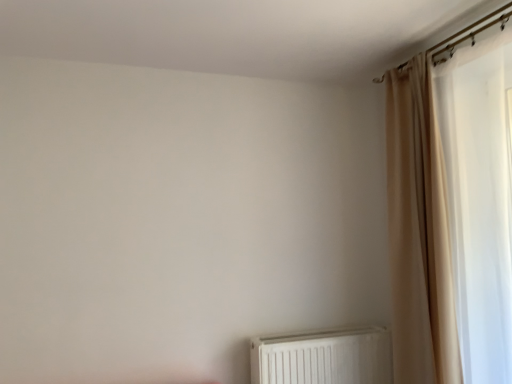
What do you see at coordinates (419, 232) in the screenshot?
I see `beige fabric curtain at right` at bounding box center [419, 232].

This screenshot has width=512, height=384. I want to click on beige fabric curtain at right, so click(x=419, y=232).

What do you see at coordinates (323, 358) in the screenshot? The height and width of the screenshot is (384, 512). I see `white plastic radiator at lower center` at bounding box center [323, 358].

What are the coordinates of `white plastic radiator at lower center` in the screenshot? It's located at (323, 358).

Where is `beige fabric curtain at right`? Image resolution: width=512 pixels, height=384 pixels. beige fabric curtain at right is located at coordinates (419, 232).

Is white plastic radiator at lower center to the left of beige fabric curtain at right from the viewer's perspective?

Yes.

Is white plastic radiator at lower center positioned behind beige fabric curtain at right?

Yes, white plastic radiator at lower center is further from the viewer.

Considering the positions of point (365, 364) and point (424, 314), is point (365, 364) closer or farther from the camera than point (424, 314)?

Point (365, 364).

From the image's perspective, which object appears higher, white plastic radiator at lower center or beige fabric curtain at right?

beige fabric curtain at right appears higher in the image.

From a real-world perspective, is white plastic radiator at lower center located higher than beige fabric curtain at right?

No.

Considering the sizes of objects white plastic radiator at lower center and beige fabric curtain at right in the image provided, who is wider, white plastic radiator at lower center or beige fabric curtain at right?

Wider between the two is beige fabric curtain at right.

Between white plastic radiator at lower center and beige fabric curtain at right, which one has less height?

Standing shorter between the two is white plastic radiator at lower center.

Is white plastic radiator at lower center bigger than beige fabric curtain at right?

No, white plastic radiator at lower center is not bigger than beige fabric curtain at right.

Is white plastic radiator at lower center not within beige fabric curtain at right?

Yes, white plastic radiator at lower center is not within beige fabric curtain at right.

Is there a large distance between white plastic radiator at lower center and beige fabric curtain at right?

white plastic radiator at lower center is near beige fabric curtain at right, not far away.

Is white plastic radiator at lower center facing towards beige fabric curtain at right?

No, white plastic radiator at lower center is not turned towards beige fabric curtain at right.

How many degrees apart are the facing directions of white plastic radiator at lower center and beige fabric curtain at right?

The facing directions of white plastic radiator at lower center and beige fabric curtain at right are 89.5 degrees apart.

Locate an element on the screen. radiator that appears below the beige fabric curtain at right (from a real-world perspective) is located at coordinates (323, 358).

In the image, is beige fabric curtain at right on the left side or the right side of white plastic radiator at lower center?

beige fabric curtain at right is to the right of white plastic radiator at lower center.

Is the depth of beige fabric curtain at right less than that of white plastic radiator at lower center?

Yes, beige fabric curtain at right is in front of white plastic radiator at lower center.

Is point (422, 364) positioned in front of point (263, 357)?

That is True.

From the image's perspective, is beige fabric curtain at right under white plastic radiator at lower center?

No.

From a real-world perspective, which object stands above the other?

From a 3D spatial view, beige fabric curtain at right is above.

Can you confirm if beige fabric curtain at right is thinner than white plastic radiator at lower center?

In fact, beige fabric curtain at right might be wider than white plastic radiator at lower center.

Considering the relative sizes of beige fabric curtain at right and white plastic radiator at lower center in the image provided, is beige fabric curtain at right shorter than white plastic radiator at lower center?

No.

Who is bigger, beige fabric curtain at right or white plastic radiator at lower center?

Result: beige fabric curtain at right is bigger.

Which is correct: beige fabric curtain at right is inside white plastic radiator at lower center, or outside of it?

beige fabric curtain at right lies outside white plastic radiator at lower center.

From the picture: Is beige fabric curtain at right far from white plastic radiator at lower center?

No, beige fabric curtain at right is in close proximity to white plastic radiator at lower center.

Is beige fabric curtain at right looking in the opposite direction of white plastic radiator at lower center?

beige fabric curtain at right does not have its back to white plastic radiator at lower center.

How different are the orientations of beige fabric curtain at right and white plastic radiator at lower center in degrees?

The angle between the facing direction of beige fabric curtain at right and the facing direction of white plastic radiator at lower center is 89.5 degrees.

Image resolution: width=512 pixels, height=384 pixels. I want to click on radiator below the beige fabric curtain at right (from the image's perspective), so click(323, 358).

The width and height of the screenshot is (512, 384). Find the location of `radiator below the beige fabric curtain at right (from the image's perspective)`. radiator below the beige fabric curtain at right (from the image's perspective) is located at coordinates (323, 358).

In the image, there is a beige fabric curtain at right. What are the coordinates of `radiator below it (from a real-world perspective)` in the screenshot? It's located at (323, 358).